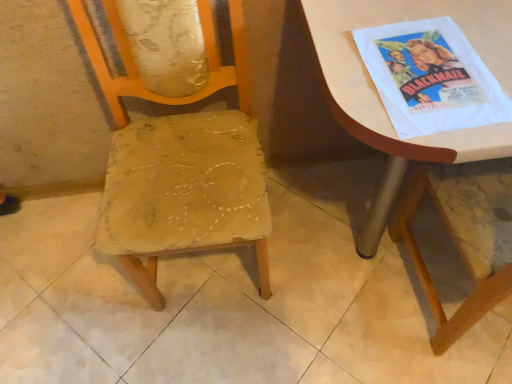
Image resolution: width=512 pixels, height=384 pixels. I want to click on vacant area that is in front of worn fabric chair at center, so click(225, 347).